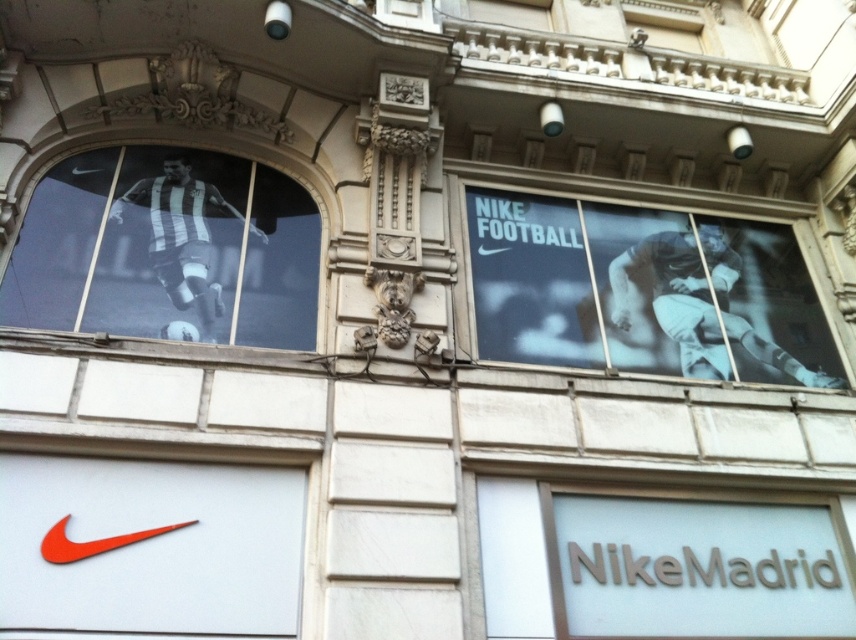
Looking at this image, how distant is blue fabric poster at right from black and white striped jersey at upper left?

A distance of 2.91 meters exists between blue fabric poster at right and black and white striped jersey at upper left.

Is blue fabric poster at right thinner than black and white striped jersey at upper left?

In fact, blue fabric poster at right might be wider than black and white striped jersey at upper left.

Is point (758, 340) farther from camera compared to point (272, 314)?

That is True.

Where is `blue fabric poster at right`? This screenshot has width=856, height=640. blue fabric poster at right is located at coordinates (643, 291).